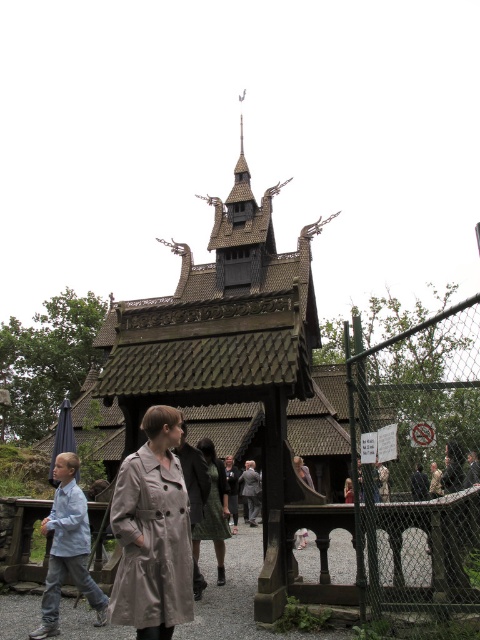
Question: Among these points, which one is nearest to the camera?

Choices:
 (A) (348, 493)
 (B) (172, 588)
 (C) (465, 365)

Answer: (B)

Question: Which of the following is the farthest from the observer?

Choices:
 (A) (427, 419)
 (B) (211, 468)
 (C) (348, 493)

Answer: (C)

Question: From the image, what is the correct spatial relationship of green chain-link fence at right in relation to matte brown coat at center?

Choices:
 (A) below
 (B) above

Answer: (B)

Question: Does light brown leather trench coat at center have a smaller size compared to matte black dress at center?

Choices:
 (A) yes
 (B) no

Answer: (B)

Question: Is light blue denim jeans at lower left behind matte black dress at center?

Choices:
 (A) no
 (B) yes

Answer: (A)

Question: Which point appears closest to the camera in this image?

Choices:
 (A) (374, 365)
 (B) (220, 534)

Answer: (A)